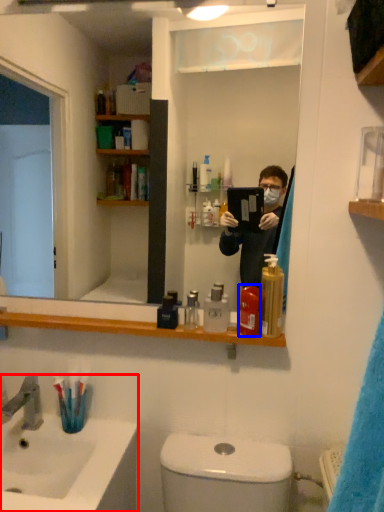
Question: Among these objects, which one is nearest to the camera, sink (highlighted by a red box) or mouthwash (highlighted by a blue box)?

Choices:
 (A) sink
 (B) mouthwash

Answer: (A)